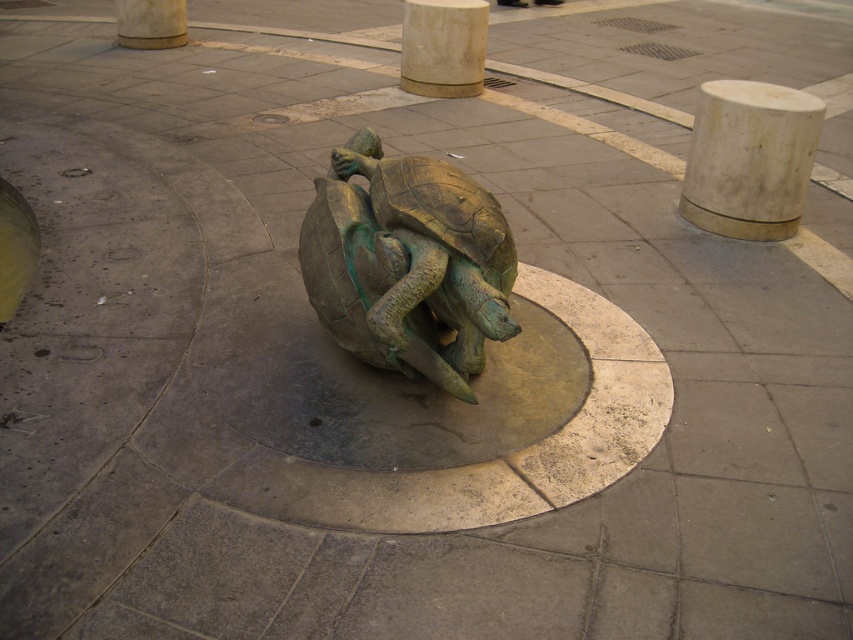
You are standing in front of the bronze turtles sculpture and want to take a photo of both the white marble pillar at center and the smooth beige pillar at upper center. Which pillar should you position yourself to the right of to capture both in the frame?

You should position yourself to the right of the smooth beige pillar at upper center because the white marble pillar at center is located to its right side, allowing both pillars to be captured in the frame when positioned this way.

You are standing in front of the bronze turtle sculpture. You see the white marble pillar at center and the smooth beige pillar at upper center. Which pillar is closer to you?

The white marble pillar at center is closer to the viewer than the smooth beige pillar at upper center.